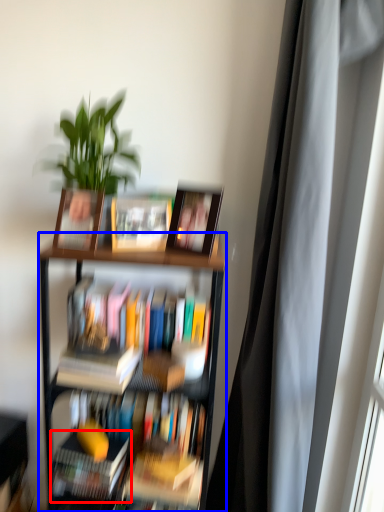
Question: Which of the following is the closest to the observer, book (highlighted by a red box) or bookcase (highlighted by a blue box)?

Choices:
 (A) book
 (B) bookcase

Answer: (B)